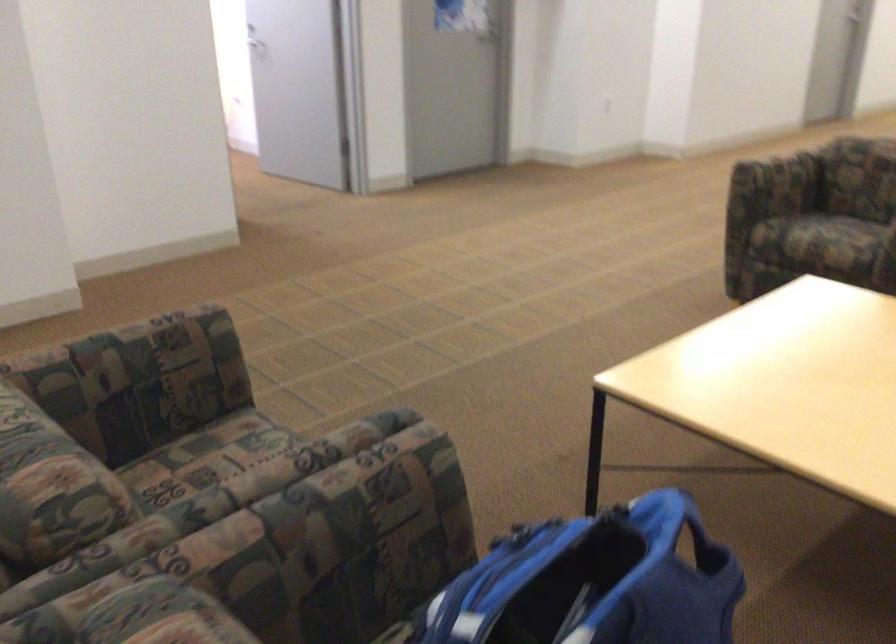
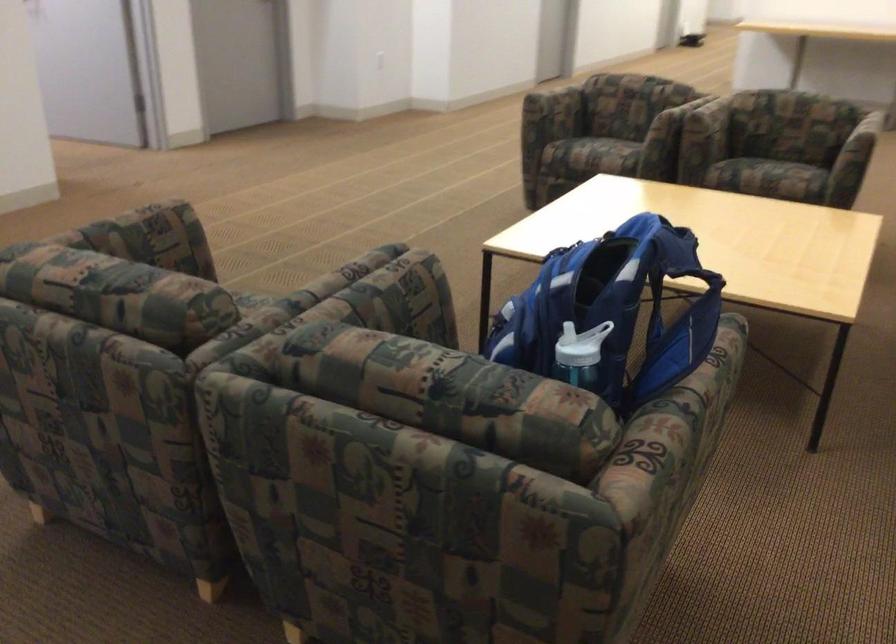
In the second image, find the point that corresponds to (771,182) in the first image.

(554, 108)